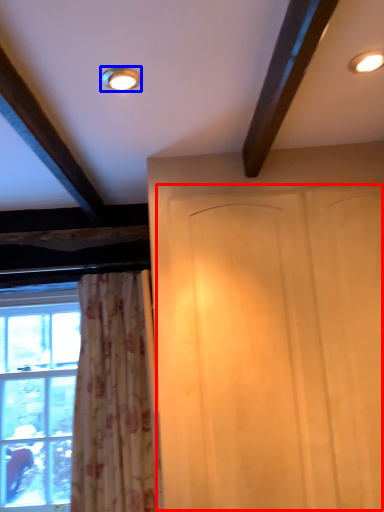
Question: Among these objects, which one is farthest to the camera, screen door (highlighted by a red box) or lighting (highlighted by a blue box)?

Choices:
 (A) screen door
 (B) lighting

Answer: (A)